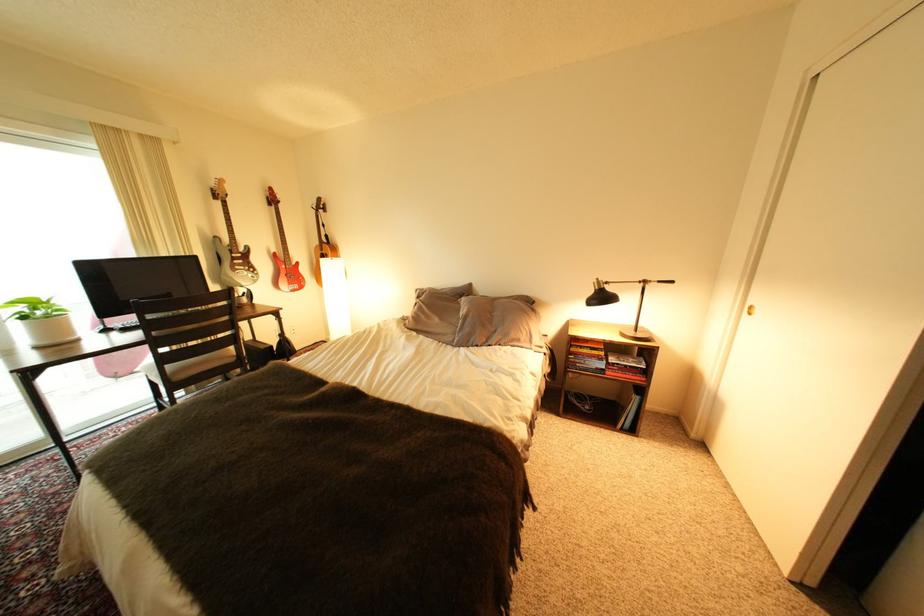
What do you see at coordinates (42, 320) in the screenshot? The width and height of the screenshot is (924, 616). I see `a white plant pot` at bounding box center [42, 320].